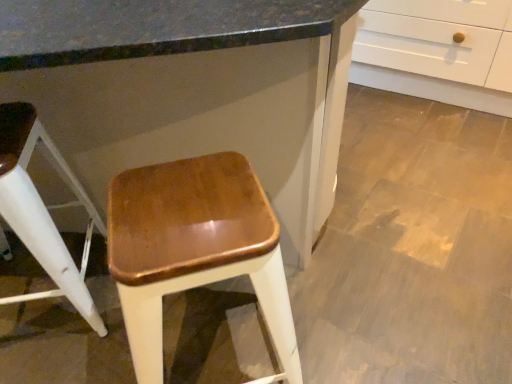
Question: Is glossy wood stool at center, positioned as the 2th stool in left-to-right order, next to white glossy cabinet at upper right and touching it?

Choices:
 (A) yes
 (B) no

Answer: (B)

Question: Is glossy wood stool at center, positioned as the 2th stool in left-to-right order, at the left side of white glossy cabinet at upper right?

Choices:
 (A) yes
 (B) no

Answer: (B)

Question: Is white glossy cabinet at upper right inside glossy wood stool at center, which ranks as the 1th stool in right-to-left order?

Choices:
 (A) yes
 (B) no

Answer: (B)

Question: Is the depth of glossy wood stool at center, positioned as the 2th stool in left-to-right order, less than that of white glossy cabinet at upper right?

Choices:
 (A) yes
 (B) no

Answer: (B)

Question: Considering the relative sizes of glossy wood stool at center, positioned as the 2th stool in left-to-right order, and white glossy cabinet at upper right in the image provided, is glossy wood stool at center, positioned as the 2th stool in left-to-right order, bigger than white glossy cabinet at upper right?

Choices:
 (A) yes
 (B) no

Answer: (B)

Question: From the image's perspective, does glossy wood stool at center, positioned as the 2th stool in left-to-right order, appear higher than white glossy cabinet at upper right?

Choices:
 (A) yes
 (B) no

Answer: (B)

Question: Is shiny brown wood stool at center, placed as the 2th stool when sorted from right to left, further to camera compared to white glossy cabinet at upper right?

Choices:
 (A) yes
 (B) no

Answer: (A)

Question: Is white glossy cabinet at upper right located within shiny brown wood stool at center, placed as the 2th stool when sorted from right to left?

Choices:
 (A) no
 (B) yes

Answer: (A)

Question: Can you confirm if shiny brown wood stool at center, acting as the 1th stool starting from the left, is positioned to the right of white glossy cabinet at upper right?

Choices:
 (A) no
 (B) yes

Answer: (B)

Question: Is shiny brown wood stool at center, acting as the 1th stool starting from the left, positioned far away from white glossy cabinet at upper right?

Choices:
 (A) yes
 (B) no

Answer: (B)

Question: From the image's perspective, would you say shiny brown wood stool at center, acting as the 1th stool starting from the left, is shown under white glossy cabinet at upper right?

Choices:
 (A) yes
 (B) no

Answer: (A)

Question: Is shiny brown wood stool at center, placed as the 2th stool when sorted from right to left, shorter than white glossy cabinet at upper right?

Choices:
 (A) yes
 (B) no

Answer: (A)

Question: Is white glossy cabinet at upper right shorter than glossy wood stool at center, positioned as the 2th stool in left-to-right order?

Choices:
 (A) yes
 (B) no

Answer: (B)